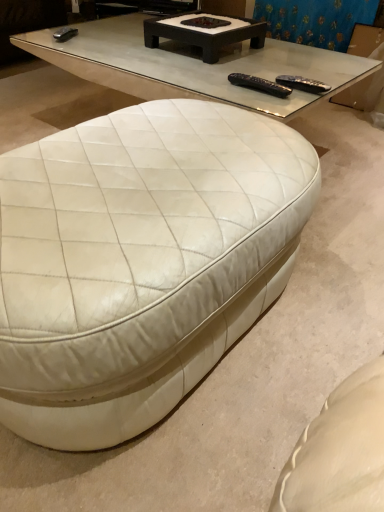
Question: Does blue fabric curtain at upper center turn towards white leather ottoman at lower left, which ranks as the 1th coffee table in bottom-to-top order?

Choices:
 (A) yes
 (B) no

Answer: (A)

Question: Does blue fabric curtain at upper center have a smaller size compared to white leather ottoman at lower left, the 1th coffee table in the front-to-back sequence?

Choices:
 (A) no
 (B) yes

Answer: (B)

Question: From the image's perspective, is blue fabric curtain at upper center below white leather ottoman at lower left, which is the 2th coffee table from top to bottom?

Choices:
 (A) yes
 (B) no

Answer: (B)

Question: Is blue fabric curtain at upper center bigger than white leather ottoman at lower left, the 1th coffee table in the front-to-back sequence?

Choices:
 (A) no
 (B) yes

Answer: (A)

Question: Is blue fabric curtain at upper center behind white leather ottoman at lower left, which ranks as the 1th coffee table in bottom-to-top order?

Choices:
 (A) no
 (B) yes

Answer: (B)

Question: From the image's perspective, relative to black plastic remote at upper right, which appears as the 2th remote when viewed from the left, is dark brown wood coffee table at upper center, the 1th coffee table when ordered from back to front, above or below?

Choices:
 (A) below
 (B) above

Answer: (B)

Question: In terms of size, does dark brown wood coffee table at upper center, positioned as the second coffee table in bottom-to-top order, appear bigger or smaller than black plastic remote at upper right, which appears as the 2th remote when viewed from the left?

Choices:
 (A) small
 (B) big

Answer: (B)

Question: Is dark brown wood coffee table at upper center, the 1th coffee table when ordered from back to front, spatially inside black plastic remote at upper right, which appears as the 2th remote when viewed from the left, or outside of it?

Choices:
 (A) outside
 (B) inside

Answer: (A)

Question: In the image, is dark brown wood coffee table at upper center, the 1th coffee table when ordered from back to front, positioned in front of or behind black plastic remote at upper right, the 1th remote from the right?

Choices:
 (A) behind
 (B) front

Answer: (A)

Question: In terms of height, does dark brown wood coffee table at upper center, the 1th coffee table when ordered from back to front, look taller or shorter compared to black plastic remote at upper center, the 1th remote viewed from the left?

Choices:
 (A) tall
 (B) short

Answer: (A)

Question: Choose the correct answer: Is dark brown wood coffee table at upper center, which ranks as the 2th coffee table in front-to-back order, inside black plastic remote at upper center, the 1th remote viewed from the left, or outside it?

Choices:
 (A) outside
 (B) inside

Answer: (A)

Question: In the image, is dark brown wood coffee table at upper center, positioned as the second coffee table in bottom-to-top order, positioned in front of or behind black plastic remote at upper center, the 1th remote viewed from the left?

Choices:
 (A) front
 (B) behind

Answer: (B)

Question: In terms of size, does dark brown wood coffee table at upper center, which ranks as the 2th coffee table in front-to-back order, appear bigger or smaller than black plastic remote at upper center, arranged as the second remote when viewed from the right?

Choices:
 (A) big
 (B) small

Answer: (A)

Question: In the image, is black plastic remote at upper center, arranged as the second remote when viewed from the right, positioned in front of or behind white leather ottoman at lower left, which ranks as the 1th coffee table in bottom-to-top order?

Choices:
 (A) front
 (B) behind

Answer: (B)

Question: From the image's perspective, is black plastic remote at upper center, the 1th remote viewed from the left, located above or below white leather ottoman at lower left, which is the 2th coffee table from top to bottom?

Choices:
 (A) below
 (B) above

Answer: (B)